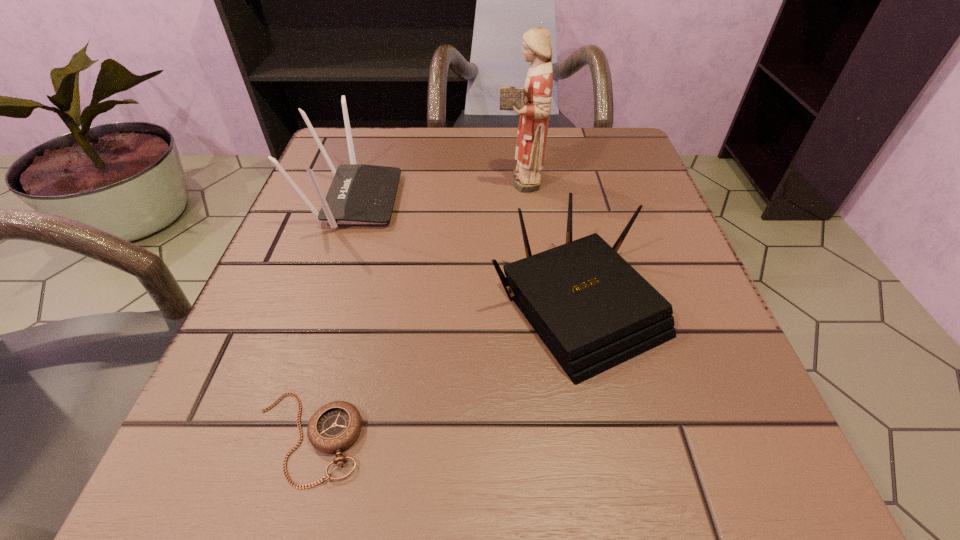
The width and height of the screenshot is (960, 540). What are the coordinates of `free space located 0.230m on the front-facing side of the taller router` in the screenshot? It's located at (519, 200).

You are a GUI agent. You are given a task and a screenshot of the screen. Output one action in this format:
    pyautogui.click(x=<x>, y=<y>)
    Task: Click on the vacant space located 0.200m on the left of the shorter router
    The height and width of the screenshot is (540, 960).
    Given the screenshot: What is the action you would take?
    pyautogui.click(x=354, y=305)

The image size is (960, 540). What are the coordinates of `vacant position located on the right of the pocket watch` in the screenshot? It's located at (518, 437).

Find the location of a particular element. This screenshot has height=540, width=960. figurine situated at the far edge is located at coordinates (532, 102).

I want to click on router that is at the far edge, so click(359, 194).

At what (x,y) coordinates should I click in order to perform the action: click on object that is at the near edge. Please return your answer as a coordinate pair (x, y). This screenshot has height=540, width=960. Looking at the image, I should click on (335, 426).

The height and width of the screenshot is (540, 960). I want to click on router that is at the left edge, so click(x=359, y=194).

Where is `pocket watch that is at the left edge`? pocket watch that is at the left edge is located at coordinates (335, 426).

What are the coordinates of `object at the right edge` in the screenshot? It's located at (593, 311).

This screenshot has width=960, height=540. In order to click on object that is at the far left corner in this screenshot , I will do `click(359, 194)`.